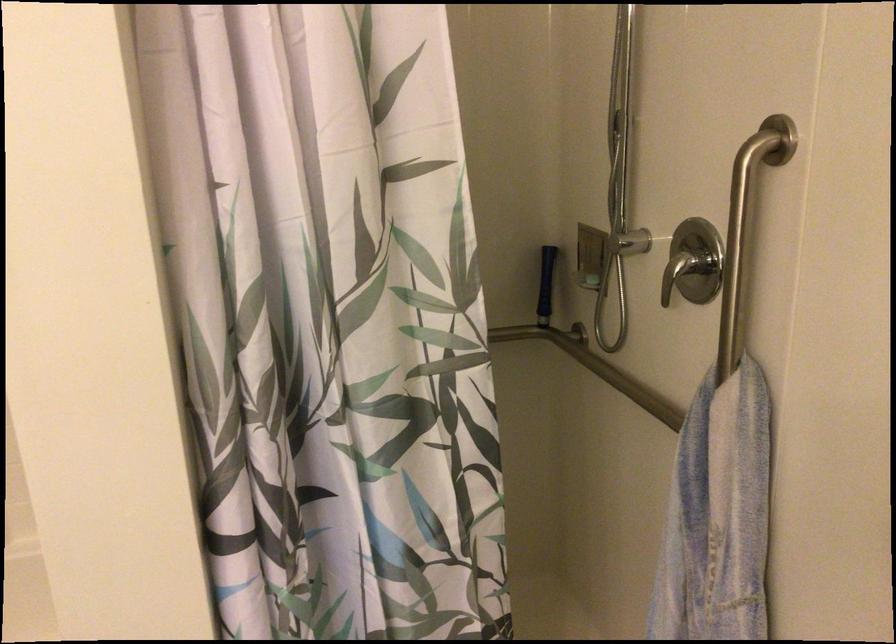
What do you see at coordinates (737, 245) in the screenshot?
I see `a vertical grab bar` at bounding box center [737, 245].